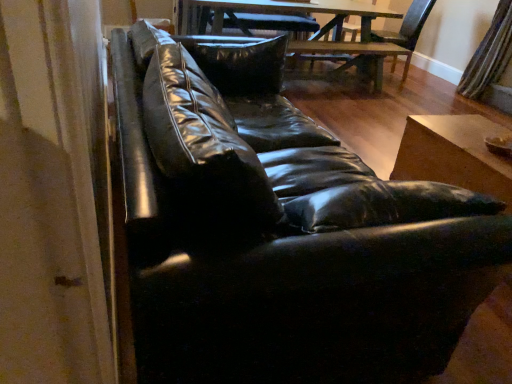
Question: Should I look upward or downward to see dark wood swivel chair at center?

Choices:
 (A) down
 (B) up

Answer: (B)

Question: From the image's perspective, is wooden table at lower right, placed as the 2th table when sorted from back to front, above wooden table at center, which is the 2th table from front to back?

Choices:
 (A) yes
 (B) no

Answer: (B)

Question: Is wooden table at lower right, positioned as the second table in top-to-bottom order, bigger than wooden table at center, which ranks as the first table in back-to-front order?

Choices:
 (A) no
 (B) yes

Answer: (A)

Question: From the image's perspective, is wooden table at lower right, which is counted as the first table, starting from the front, located beneath wooden table at center, acting as the 1th table starting from the top?

Choices:
 (A) no
 (B) yes

Answer: (B)

Question: Does wooden table at lower right, placed as the 2th table when sorted from back to front, have a lesser width compared to wooden table at center, which is the 2th table from front to back?

Choices:
 (A) yes
 (B) no

Answer: (A)

Question: Is wooden table at lower right, placed as the 2th table when sorted from back to front, at the right side of wooden table at center, acting as the 1th table starting from the top?

Choices:
 (A) no
 (B) yes

Answer: (B)

Question: Could you tell me if wooden table at lower right, which appears as the first table when ordered from the bottom, is facing wooden table at center, which is the 2th table from bottom to top?

Choices:
 (A) yes
 (B) no

Answer: (B)

Question: Considering the relative sizes of striped fabric curtain at right and wooden table at lower right, which is counted as the first table, starting from the front, in the image provided, is striped fabric curtain at right thinner than wooden table at lower right, which is counted as the first table, starting from the front,?

Choices:
 (A) no
 (B) yes

Answer: (B)

Question: Is striped fabric curtain at right to the right of wooden table at lower right, which appears as the first table when ordered from the bottom, from the viewer's perspective?

Choices:
 (A) no
 (B) yes

Answer: (B)

Question: From the image's perspective, is striped fabric curtain at right located above wooden table at lower right, positioned as the second table in top-to-bottom order?

Choices:
 (A) no
 (B) yes

Answer: (B)

Question: From the image's perspective, does striped fabric curtain at right appear lower than wooden table at lower right, positioned as the second table in top-to-bottom order?

Choices:
 (A) yes
 (B) no

Answer: (B)

Question: Is the depth of striped fabric curtain at right greater than that of wooden table at lower right, placed as the 2th table when sorted from back to front?

Choices:
 (A) yes
 (B) no

Answer: (A)

Question: Is striped fabric curtain at right beside wooden table at lower right, positioned as the second table in top-to-bottom order?

Choices:
 (A) no
 (B) yes

Answer: (A)

Question: Would you say striped fabric curtain at right is part of wooden table at center, which ranks as the first table in back-to-front order,'s contents?

Choices:
 (A) yes
 (B) no

Answer: (B)